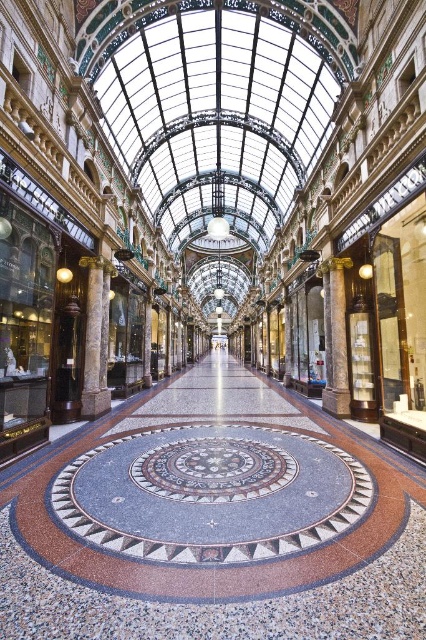
Question: Based on their relative distances, which object is farther from the marble mosaic floor at center?

Choices:
 (A) marble column at left
 (B) marble column at center

Answer: (B)

Question: Among these objects, which one is farthest from the camera?

Choices:
 (A) marble column at center
 (B) marble column at left
 (C) marble mosaic floor at center

Answer: (A)

Question: Can you confirm if marble mosaic floor at center is positioned above marble column at left?

Choices:
 (A) yes
 (B) no

Answer: (B)

Question: Can you confirm if marble column at left is smaller than marble column at center?

Choices:
 (A) yes
 (B) no

Answer: (B)

Question: Which object is closer to the camera taking this photo?

Choices:
 (A) marble column at center
 (B) marble mosaic floor at center

Answer: (B)

Question: Is marble mosaic floor at center closer to the viewer compared to marble column at center?

Choices:
 (A) no
 (B) yes

Answer: (B)